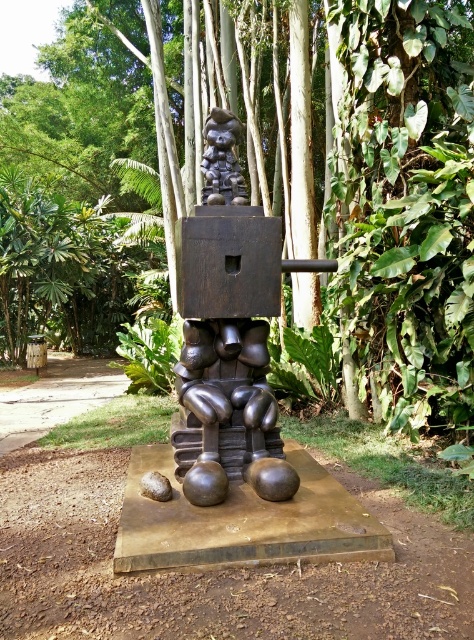
Question: Among these objects, which one is nearest to the camera?

Choices:
 (A) black matte skull at upper center
 (B) green leafy tree at center

Answer: (B)

Question: Is black matte skull at upper center to the right of brown smooth rock at center from the viewer's perspective?

Choices:
 (A) yes
 (B) no

Answer: (A)

Question: Does green leafy tree at center appear under brown smooth rock at center?

Choices:
 (A) yes
 (B) no

Answer: (B)

Question: Which of the following is the closest to the observer?

Choices:
 (A) green leafy tree at center
 (B) black matte skull at upper center
 (C) brown smooth rock at center

Answer: (C)

Question: Which is nearer to the green leafy tree at center?

Choices:
 (A) black matte skull at upper center
 (B) brown smooth rock at center

Answer: (A)

Question: Is green leafy tree at center above black matte skull at upper center?

Choices:
 (A) yes
 (B) no

Answer: (A)